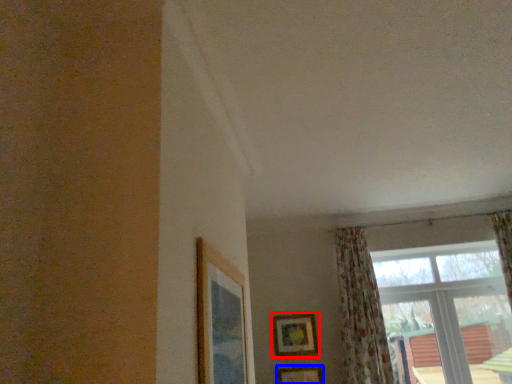
Question: Which of the following is the closest to the observer, picture frame (highlighted by a red box) or picture frame (highlighted by a blue box)?

Choices:
 (A) picture frame
 (B) picture frame

Answer: (B)